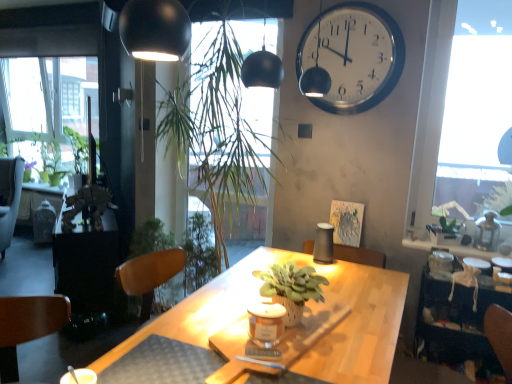
Question: Is matte glass candle at center beside metallic brown table at left, the first table positioned from the left?

Choices:
 (A) no
 (B) yes

Answer: (A)

Question: From a real-world perspective, is matte glass candle at center below metallic brown table at left, positioned as the 2th table in right-to-left order?

Choices:
 (A) yes
 (B) no

Answer: (B)

Question: From the image's perspective, is matte glass candle at center under metallic brown table at left, the first table positioned from the left?

Choices:
 (A) yes
 (B) no

Answer: (A)

Question: From a real-world perspective, is matte glass candle at center over metallic brown table at left, positioned as the 2th table in right-to-left order?

Choices:
 (A) yes
 (B) no

Answer: (A)

Question: Is matte glass candle at center closer to camera compared to metallic brown table at left, positioned as the 2th table in right-to-left order?

Choices:
 (A) no
 (B) yes

Answer: (B)

Question: Is matte glass candle at center in front of or behind wooden desk at center in the image?

Choices:
 (A) front
 (B) behind

Answer: (A)

Question: From a real-world perspective, relative to wooden desk at center, is matte glass candle at center vertically above or below?

Choices:
 (A) below
 (B) above

Answer: (B)

Question: Is matte glass candle at center to the left or to the right of wooden desk at center in the image?

Choices:
 (A) left
 (B) right

Answer: (B)

Question: In terms of height, does matte glass candle at center look taller or shorter compared to wooden desk at center?

Choices:
 (A) tall
 (B) short

Answer: (B)

Question: Considering the positions of transparent glass window at upper right and green matte plant at center in the image, is transparent glass window at upper right bigger or smaller than green matte plant at center?

Choices:
 (A) small
 (B) big

Answer: (B)

Question: In terms of height, does transparent glass window at upper right look taller or shorter compared to green matte plant at center?

Choices:
 (A) tall
 (B) short

Answer: (A)

Question: Considering the positions of transparent glass window at upper right and green matte plant at center in the image, is transparent glass window at upper right wider or thinner than green matte plant at center?

Choices:
 (A) thin
 (B) wide

Answer: (A)

Question: From a real-world perspective, is transparent glass window at upper right above or below green matte plant at center?

Choices:
 (A) above
 (B) below

Answer: (A)

Question: From their relative heights in the image, would you say velvet brown armchair at left is taller or shorter than green matte plant at upper right, marked as the 1th plant in a right-to-left arrangement?

Choices:
 (A) tall
 (B) short

Answer: (A)

Question: In terms of width, does velvet brown armchair at left look wider or thinner when compared to green matte plant at upper right, the second plant positioned from the front?

Choices:
 (A) wide
 (B) thin

Answer: (A)